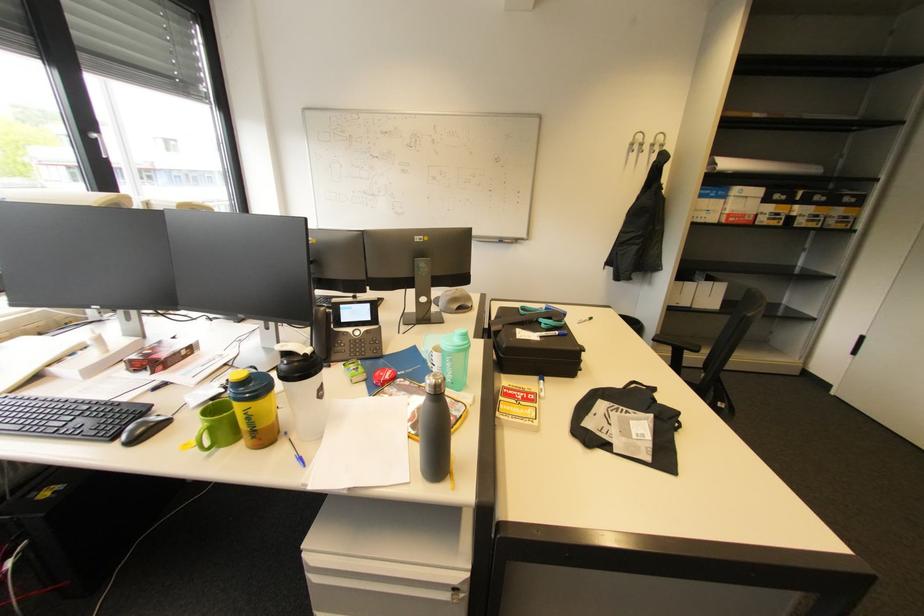
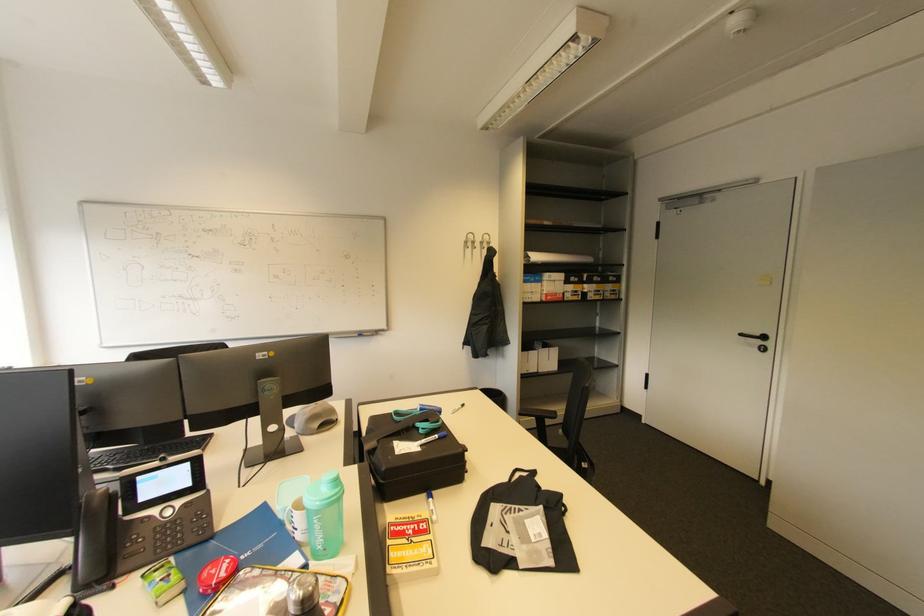
In the second image, find the point that corresponds to point 658,146 in the first image.

(487, 244)